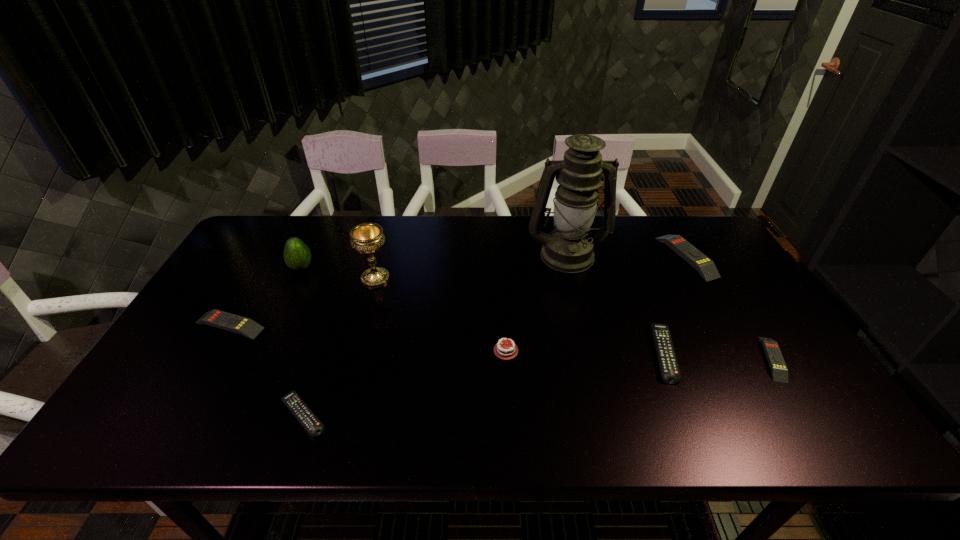
Find the location of a particular element. the leftmost remote control is located at coordinates (247, 327).

The image size is (960, 540). I want to click on the farther black remote control, so click(669, 368).

This screenshot has height=540, width=960. What are the coordinates of `the seventh object from left to right` in the screenshot? It's located at (669, 368).

Identify the location of the smallest yellow remote control. Image resolution: width=960 pixels, height=540 pixels. (779, 371).

Locate an element on the screen. This screenshot has height=540, width=960. the shortest object is located at coordinates (292, 400).

You are a GUI agent. You are given a task and a screenshot of the screen. Output one action in this format:
    pyautogui.click(x=<x>, y=<y>)
    Task: Click on the smaller black remote control
    This screenshot has height=540, width=960.
    Given the screenshot: What is the action you would take?
    pyautogui.click(x=292, y=400)

Locate an element on the screen. The height and width of the screenshot is (540, 960). vacant space located 0.130m on the left of the tallest object is located at coordinates (486, 254).

You are a GUI agent. You are given a task and a screenshot of the screen. Output one action in this format:
    pyautogui.click(x=<x>, y=<y>)
    Task: Click on the free space located on the left of the chalice
    This screenshot has height=540, width=960.
    Given the screenshot: What is the action you would take?
    pyautogui.click(x=231, y=279)

You are a GUI agent. You are given a task and a screenshot of the screen. Output one action in this format:
    pyautogui.click(x=<x>, y=<y>)
    Task: Click on the vacant space situated 0.130m on the right of the green avocado
    
    Given the screenshot: What is the action you would take?
    pyautogui.click(x=356, y=268)

This screenshot has width=960, height=540. In order to click on vacant space situated 0.170m on the front of the tallest remote control in this screenshot , I will do `click(724, 323)`.